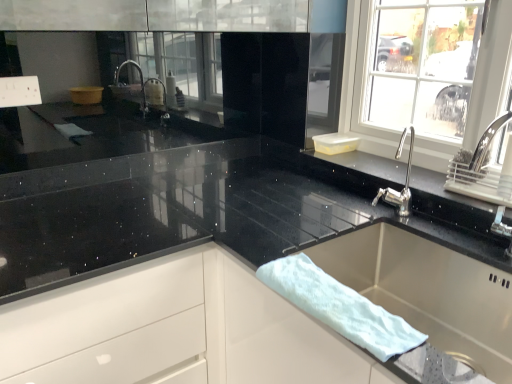
Question: Based on their sizes in the image, would you say white fluffy bath towel at sink is bigger or smaller than white glossy drawer at center?

Choices:
 (A) small
 (B) big

Answer: (A)

Question: Considering their positions, is white fluffy bath towel at sink located in front of or behind white glossy drawer at center?

Choices:
 (A) behind
 (B) front

Answer: (B)

Question: Which object is positioned farthest from the stainless steel sink at lower right?

Choices:
 (A) white fluffy bath towel at sink
 (B) white glossy drawer at center

Answer: (B)

Question: Estimate the real-world distances between objects in this image. Which object is closer to the white glossy drawer at center?

Choices:
 (A) white fluffy bath towel at sink
 (B) stainless steel sink at lower right

Answer: (A)